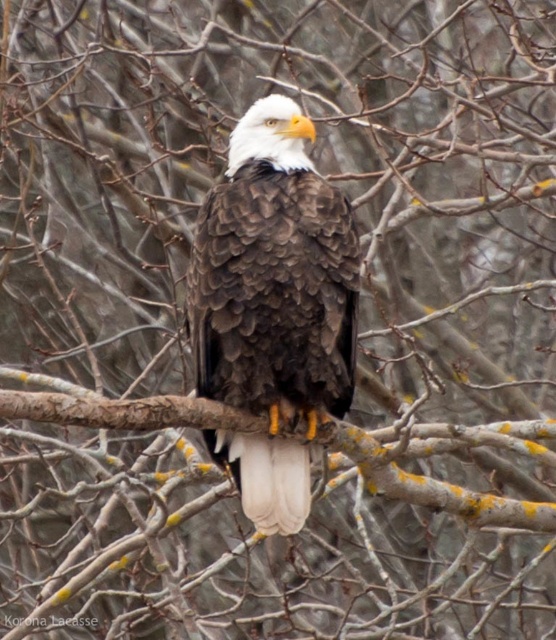
You are an ornithologist studying the bald eagle in the image. You notice the dark brown feathers at center. Can you determine the exact coordinates of these feathers?

The dark brown feathers at center are located at point (272, 307).

You are an ornithologist observing the bald eagle in the scene. You notice the dark brown feathers at center and the brown rough tree branch at center. Which object is narrower in width?

The dark brown feathers at center are narrower in width compared to the brown rough tree branch at center.

You are a birdwatcher trying to identify a bald eagle in the image. The eagle has a specific point at coordinates point (x=272, y=307). What part of the eagle does this point correspond to?

The point (x=272, y=307) corresponds to the dark brown feathers at center, which are part of the eagle.